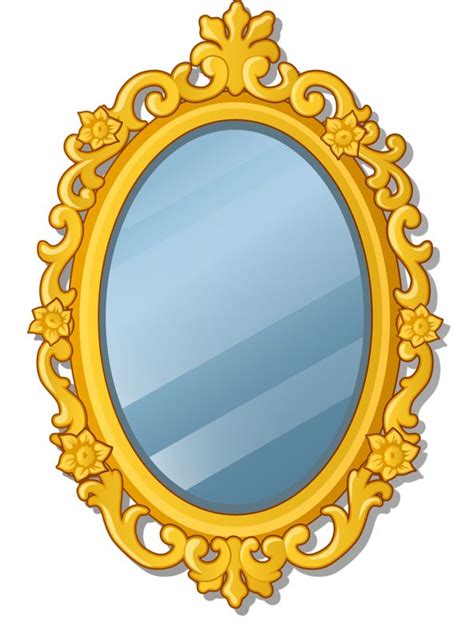
The width and height of the screenshot is (474, 639). What are the coordinates of `frame` in the screenshot? It's located at (236, 525).